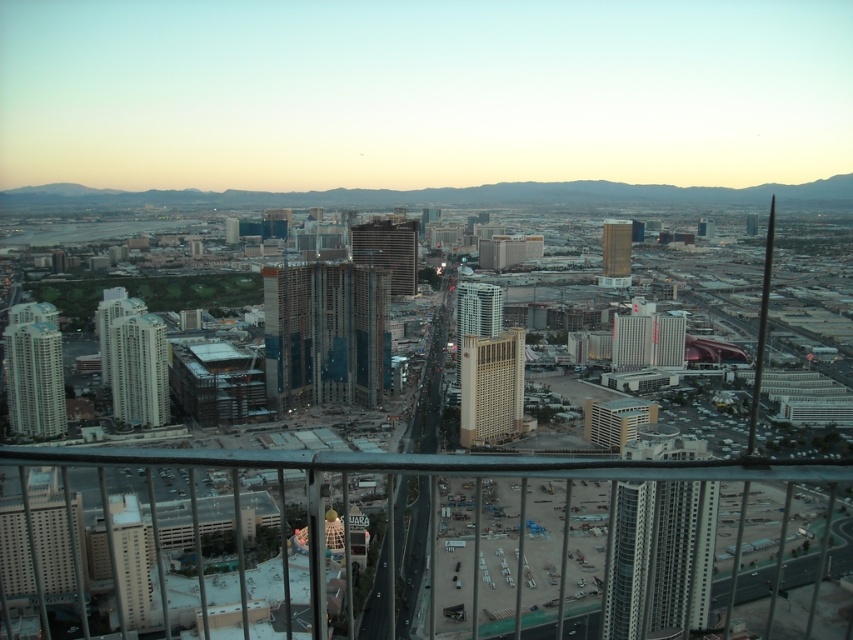
Question: Can you confirm if metallic glass skyscraper at center is thinner than white glossy hotel at center?

Choices:
 (A) yes
 (B) no

Answer: (B)

Question: Which point is farther to the camera?

Choices:
 (A) light beige concrete building at center
 (B) metallic glass skyscraper at center
 (C) white glossy hotel at center

Answer: (C)

Question: Estimate the real-world distances between objects in this image. Which object is farther from the matte glass skyscraper at center?

Choices:
 (A) white glossy building at left
 (B) gold textured hotel at center
 (C) matte glass skyscraper at left
 (D) metallic glass skyscraper at center

Answer: (C)

Question: Does matte glass skyscraper at left come behind matte glass skyscraper at center?

Choices:
 (A) no
 (B) yes

Answer: (A)

Question: Which of the following is the farthest from the observer?

Choices:
 (A) white glossy building at left
 (B) white glossy hotel at center

Answer: (B)

Question: Can you confirm if glassy steel skyscraper at center is smaller than matte glass skyscraper at center?

Choices:
 (A) no
 (B) yes

Answer: (A)